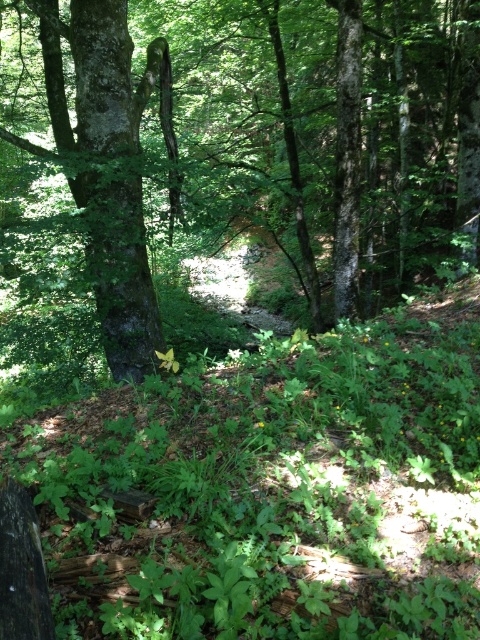
You are a hiker who wants to walk from the point at coordinates (107,12) to another point in the forest. The path you choose must be exactly 6.74 meters long. Can you confirm if this distance is possible within the forest depicted?

Yes, the distance between the point at coordinates (107,12) and the other point is exactly 6.74 meters, so the path you choose can be exactly that length.

You are navigating through the forest and need to locate the green rough bark tree at center. According to the coordinates provided, where exactly is this tree positioned in the image?

The green rough bark tree at center is located at point coordinates of 0.237 along the horizontal axis and 0.510 along the vertical axis.

You are a hiker trying to identify two trees in the forest. You see a green rough bark tree at center and a smooth bark tree at center. Which tree has a larger width?

The green rough bark tree at center has a larger width than the smooth bark tree at center according to the description.